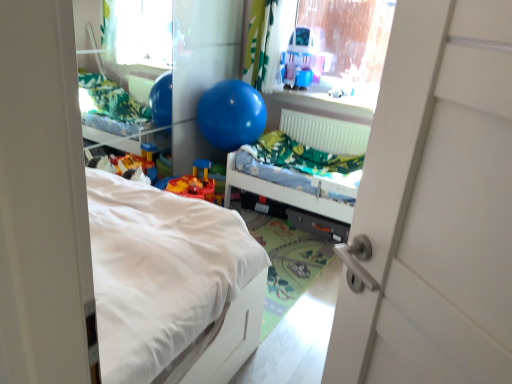
This screenshot has width=512, height=384. Identify the location of empty space that is ontop of white plastic radiator at upper center (from a real-world perspective). (328, 115).